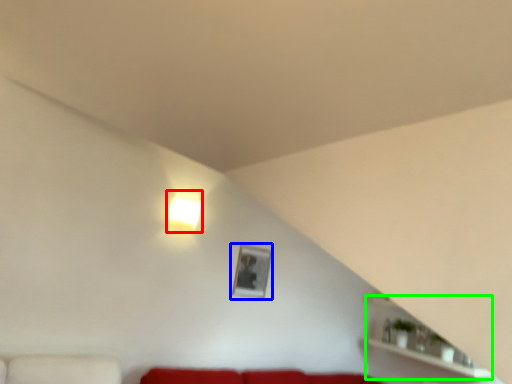
Question: Which object is positioned closest to lamp (highlighted by a red box)? Select from picture frame (highlighted by a blue box) and shelf (highlighted by a green box).

Choices:
 (A) picture frame
 (B) shelf

Answer: (A)